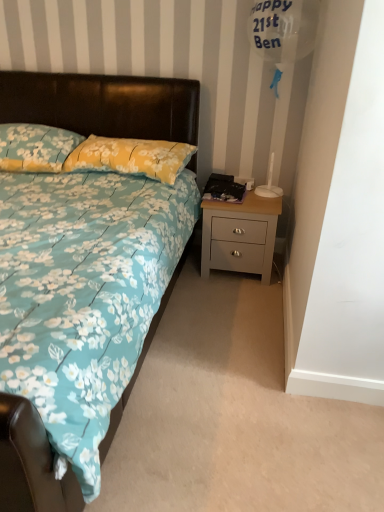
Question: Based on their positions, is floral fabric pillow at upper left, arranged as the first pillow when viewed from the left, located to the left or right of yellow floral fabric pillow at center, the first pillow viewed from the right?

Choices:
 (A) left
 (B) right

Answer: (A)

Question: Looking at their shapes, would you say floral fabric pillow at upper left, arranged as the first pillow when viewed from the left, is wider or thinner than yellow floral fabric pillow at center, the first pillow viewed from the right?

Choices:
 (A) wide
 (B) thin

Answer: (A)

Question: Which object is positioned farthest from the floral fabric bed at center?

Choices:
 (A) light gray wood nightstand at lower right
 (B) floral fabric pillow at upper left, arranged as the first pillow when viewed from the left
 (C) yellow floral fabric pillow at center, the first pillow viewed from the right

Answer: (A)

Question: Estimate the real-world distances between objects in this image. Which object is farther from the light gray wood nightstand at lower right?

Choices:
 (A) floral fabric bed at center
 (B) floral fabric pillow at upper left, the 2th pillow positioned from the right
 (C) yellow floral fabric pillow at center, the first pillow viewed from the right

Answer: (B)